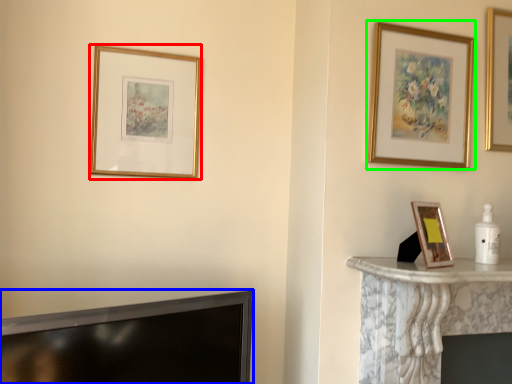
Question: Based on their relative distances, which object is farther from picture frame (highlighted by a red box)? Choose from television (highlighted by a blue box) and picture frame (highlighted by a green box).

Choices:
 (A) television
 (B) picture frame

Answer: (B)